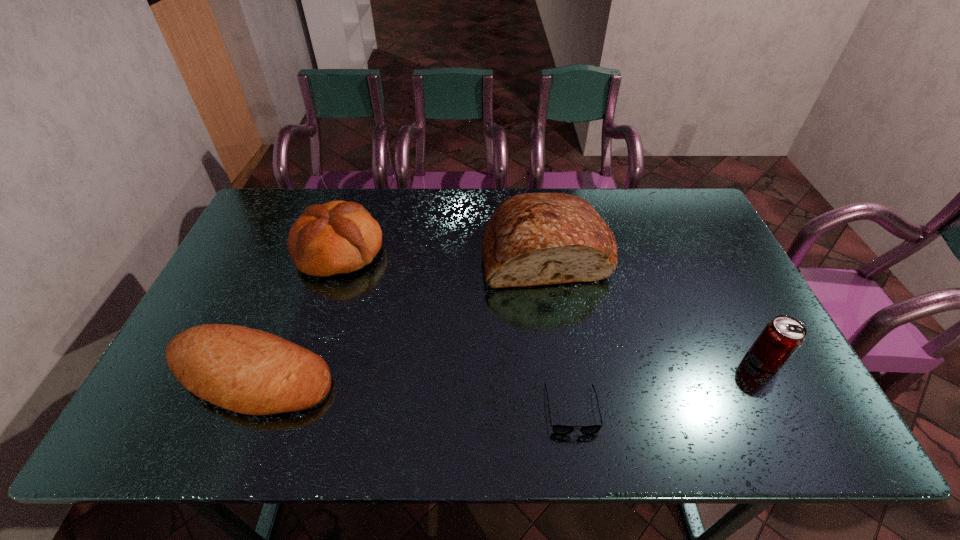
I want to click on vacant area that lies between the shortest bread and the spectacles, so click(x=412, y=393).

Find the location of a particular element. object that is the closest to the rightmost bread is located at coordinates (558, 429).

Select which object appears as the closest to the shortest bread. Please provide its 2D coordinates. Your answer should be formatted as a tuple, i.e. [(x, y)], where the tuple contains the x and y coordinates of a point satisfying the conditions above.

[(337, 237)]

Choose which bread is the nearest neighbor to the second tallest bread. Please provide its 2D coordinates. Your answer should be formatted as a tuple, i.e. [(x, y)], where the tuple contains the x and y coordinates of a point satisfying the conditions above.

[(248, 371)]

What are the coordinates of `bread that stands as the closest to the shortest object` in the screenshot? It's located at (531, 239).

The width and height of the screenshot is (960, 540). I want to click on blank space that satisfies the following two spatial constraints: 1. at the sliced front of the rightmost object; 2. on the right side of the rightmost bread, so click(x=563, y=360).

Where is `free location that satisfies the following two spatial constraints: 1. at the sliced front of the rightmost object; 2. on the left side of the tallest object`? free location that satisfies the following two spatial constraints: 1. at the sliced front of the rightmost object; 2. on the left side of the tallest object is located at coordinates [x=563, y=360].